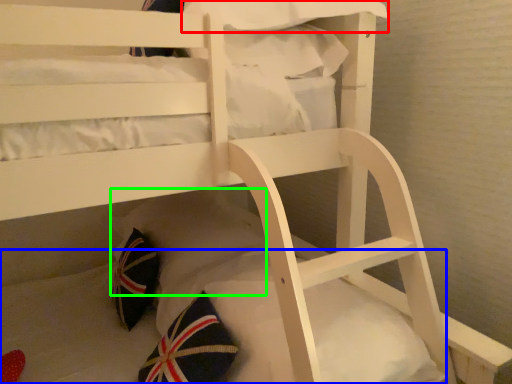
Question: Which object is positioned closest to pillow (highlighted by a red box)? Select from mattress (highlighted by a blue box) and pillow (highlighted by a green box).

Choices:
 (A) mattress
 (B) pillow

Answer: (B)